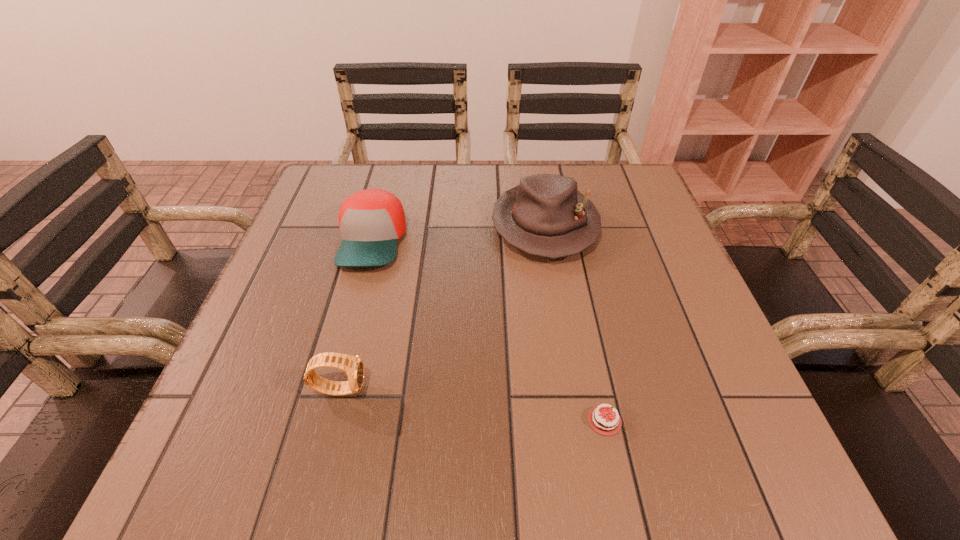
Where is `unoccupied area between the baseball cap and the watch`? The height and width of the screenshot is (540, 960). unoccupied area between the baseball cap and the watch is located at coordinates (356, 314).

Where is `unoccupied area between the chocolate cake and the baseball cap`? The width and height of the screenshot is (960, 540). unoccupied area between the chocolate cake and the baseball cap is located at coordinates (489, 330).

The width and height of the screenshot is (960, 540). I want to click on empty space between the baseball cap and the hat, so click(459, 233).

Choose which object is the third nearest neighbor to the hat. Please provide its 2D coordinates. Your answer should be formatted as a tuple, i.e. [(x, y)], where the tuple contains the x and y coordinates of a point satisfying the conditions above.

[(353, 365)]

This screenshot has width=960, height=540. What are the coordinates of `object that is the third closest to the baseball cap` in the screenshot? It's located at (602, 421).

In order to click on vacant region that satisfies the following two spatial constraints: 1. on the decorative side of the hat; 2. on the right side of the chocolate cake in this screenshot , I will do `click(577, 421)`.

The image size is (960, 540). Find the location of `vacant space that satisfies the following two spatial constraints: 1. on the face of the watch; 2. on the right side of the chocolate cake`. vacant space that satisfies the following two spatial constraints: 1. on the face of the watch; 2. on the right side of the chocolate cake is located at coordinates [x=332, y=421].

I want to click on vacant space that satisfies the following two spatial constraints: 1. on the decorative side of the hat; 2. on the right side of the chocolate cake, so click(x=577, y=421).

Locate an element on the screen. free space that satisfies the following two spatial constraints: 1. on the decorative side of the hat; 2. on the right side of the shortest object is located at coordinates (577, 421).

At what (x,y) coordinates should I click in order to perform the action: click on free space that satisfies the following two spatial constraints: 1. at the brim of the baseball cap; 2. on the left side of the chocolate cake. Please return your answer as a coordinate pair (x, y). Looking at the image, I should click on (324, 421).